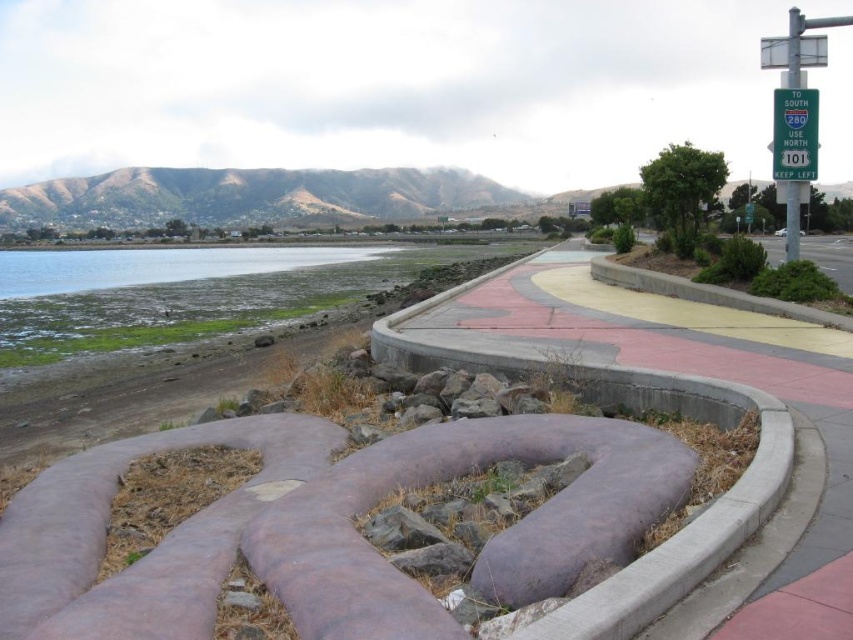
Question: Is clear water at lower left above green plastic sign at upper right?

Choices:
 (A) yes
 (B) no

Answer: (A)

Question: Is purple matte sculpture at center positioned before clear water at lower left?

Choices:
 (A) yes
 (B) no

Answer: (A)

Question: Which object is positioned farthest from the green plastic sign at upper right?

Choices:
 (A) clear water at lower left
 (B) purple matte sculpture at center

Answer: (A)

Question: Can you confirm if purple matte sculpture at center is positioned above clear water at lower left?

Choices:
 (A) yes
 (B) no

Answer: (B)

Question: Which object is positioned farthest from the clear water at lower left?

Choices:
 (A) green plastic sign at upper right
 (B) purple matte sculpture at center

Answer: (B)

Question: Considering the real-world distances, which object is farthest from the purple matte sculpture at center?

Choices:
 (A) purple rubber path at center
 (B) clear water at lower left

Answer: (B)